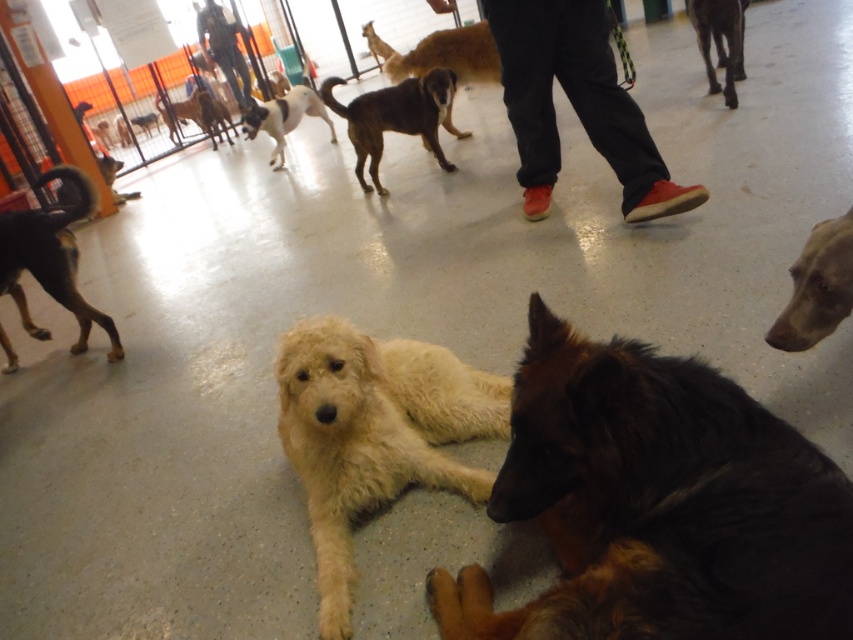
Who is higher up, brown shaggy dog at lower right or white fur dog at upper center?

white fur dog at upper center

Does brown shaggy dog at lower right appear on the left side of white fur dog at upper center?

Incorrect, brown shaggy dog at lower right is not on the left side of white fur dog at upper center.

Where is `brown shaggy dog at lower right`? brown shaggy dog at lower right is located at coordinates (657, 504).

The width and height of the screenshot is (853, 640). I want to click on brown shaggy dog at lower right, so click(x=657, y=504).

Does point (730, 458) come closer to viewer compared to point (802, 262)?

Yes, point (730, 458) is closer to viewer.

Who is more forward, (x=529, y=481) or (x=840, y=237)?

Point (x=529, y=481) is more forward.

Between point (567, 348) and point (819, 316), which one is positioned in front?

Point (567, 348) is more forward.

Locate an element on the screen. This screenshot has width=853, height=640. brown shaggy dog at lower right is located at coordinates (657, 504).

Can you confirm if light beige fur at center is thinner than white fur dog at upper center?

Correct, light beige fur at center's width is less than white fur dog at upper center's.

Which is in front, point (450, 356) or point (270, 104)?

Point (450, 356) is in front.

Is point (399, 353) closer to viewer compared to point (279, 97)?

Yes.

The image size is (853, 640). I want to click on light beige fur at center, so click(x=374, y=435).